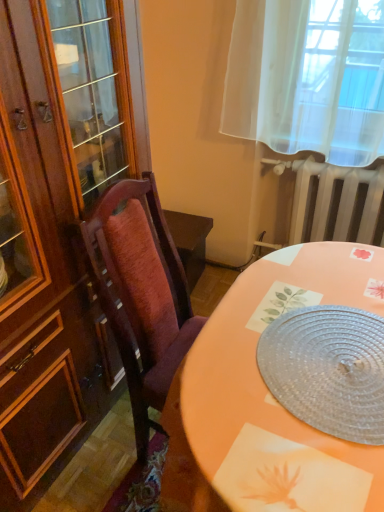
Question: Looking at their shapes, would you say clear plastic placemat at center is wider or thinner than white metallic radiator at upper right?

Choices:
 (A) thin
 (B) wide

Answer: (B)

Question: Is clear plastic placemat at center situated inside white metallic radiator at upper right or outside?

Choices:
 (A) inside
 (B) outside

Answer: (B)

Question: From their relative heights in the image, would you say clear plastic placemat at center is taller or shorter than white metallic radiator at upper right?

Choices:
 (A) short
 (B) tall

Answer: (A)

Question: Is white metallic radiator at upper right bigger or smaller than clear plastic placemat at center?

Choices:
 (A) big
 (B) small

Answer: (A)

Question: In the image, is white metallic radiator at upper right positioned in front of or behind clear plastic placemat at center?

Choices:
 (A) front
 (B) behind

Answer: (B)

Question: Looking at their shapes, would you say white metallic radiator at upper right is wider or thinner than clear plastic placemat at center?

Choices:
 (A) wide
 (B) thin

Answer: (B)

Question: Which is correct: white metallic radiator at upper right is inside clear plastic placemat at center, or outside of it?

Choices:
 (A) outside
 (B) inside

Answer: (A)